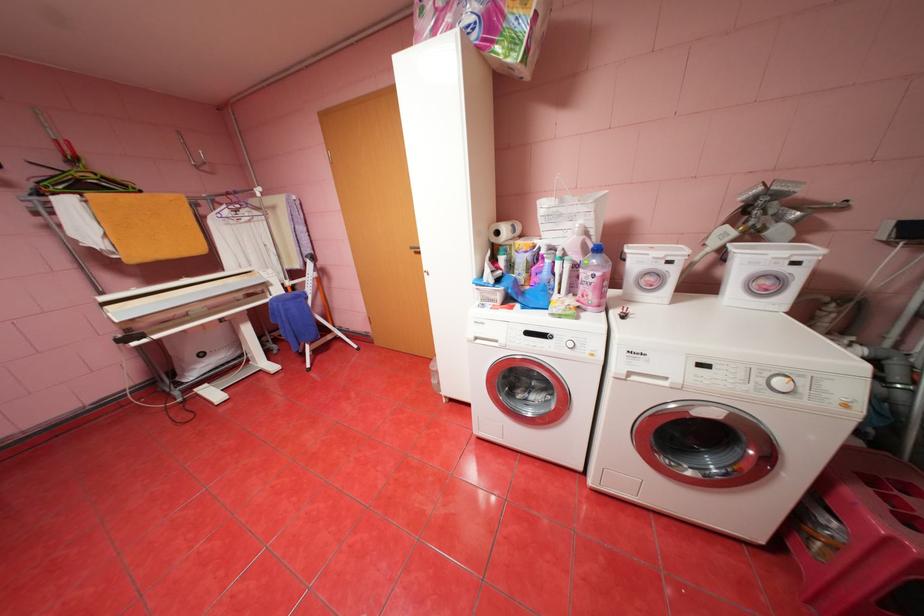
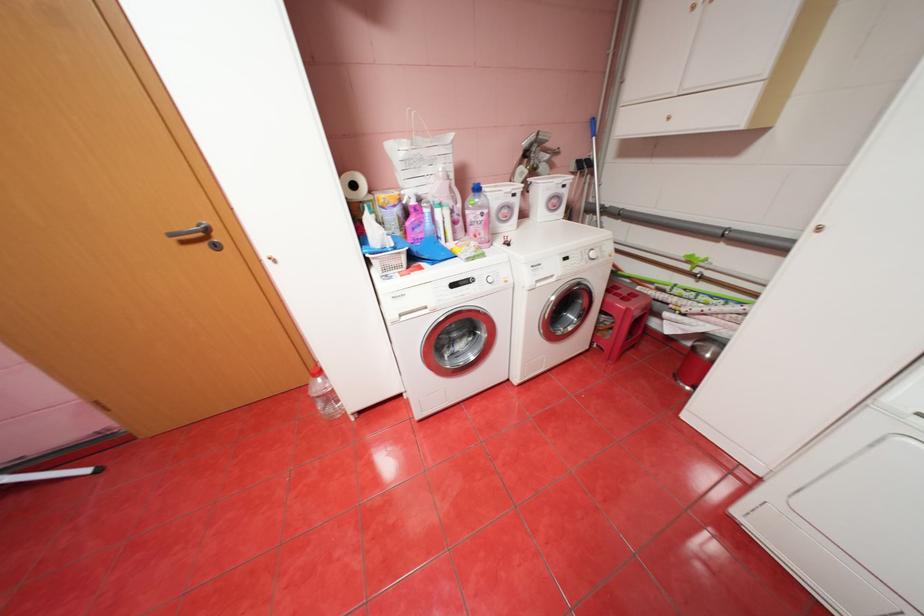
Locate, in the second image, the point that corresponds to [505,233] in the first image.

(362, 185)